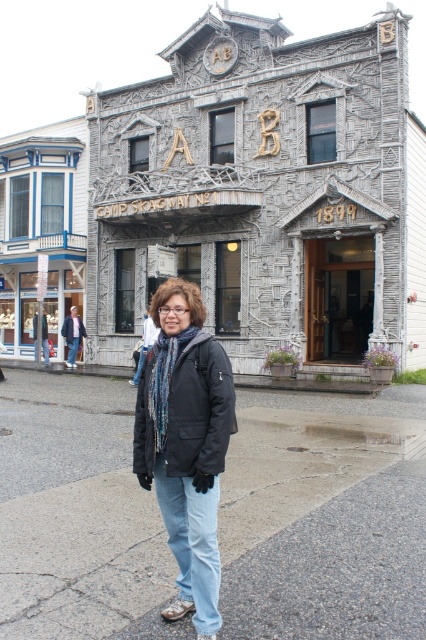
You are a painter who wants to paint the gray stone building at center and the gray asphalt pavement at lower center. Which one will require more ladder height to reach the highest point?

The gray stone building at center is much taller than the gray asphalt pavement at lower center, so you will need a taller ladder to paint the gray stone building at center.

You are a delivery person standing at the location of the matte black jacket at center. You need to deliver a package to the gray stone building at center. The delivery robot you use has a maximum range of 20 meters. Will the robot be able to reach the building?

The distance between the matte black jacket at center and the gray stone building at center is 18.84 meters, which is within the robot s 20 meter range. Therefore, the robot can successfully deliver the package to the gray stone building at center.

You are standing in front of the historic building and want to touch both points mentioned. Which point should you reach for first, the point at coordinate (x=193, y=289) or the point at coordinate (x=201, y=390)?

You should reach for the point at coordinate (x=193, y=289) first because it is closer to you than the point at coordinate (x=201, y=390).